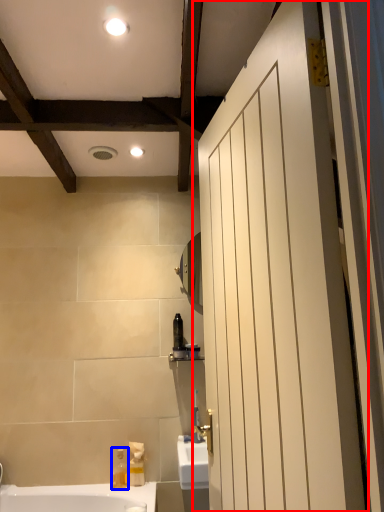
Question: Which object appears farthest to the camera in this image, door (highlighted by a red box) or soap dispenser (highlighted by a blue box)?

Choices:
 (A) door
 (B) soap dispenser

Answer: (B)